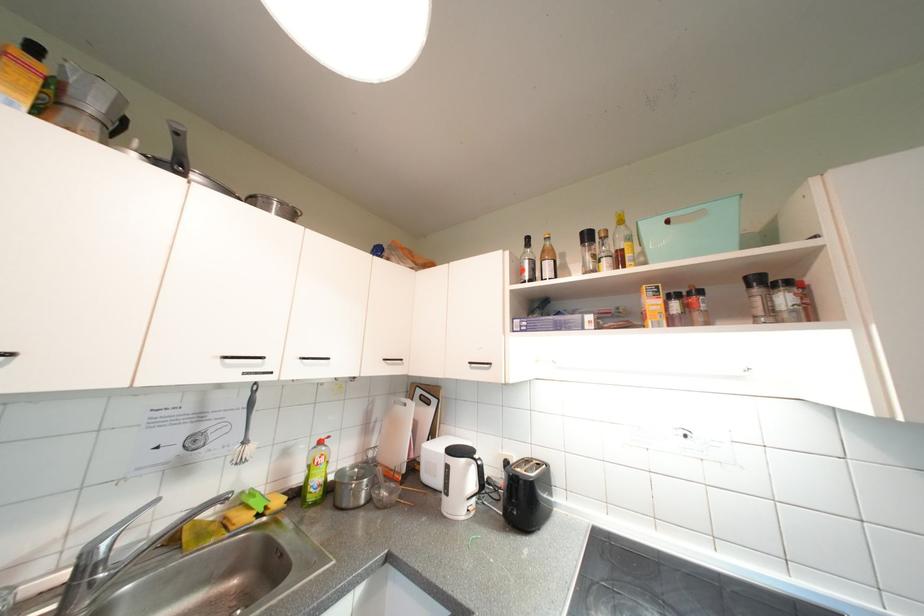
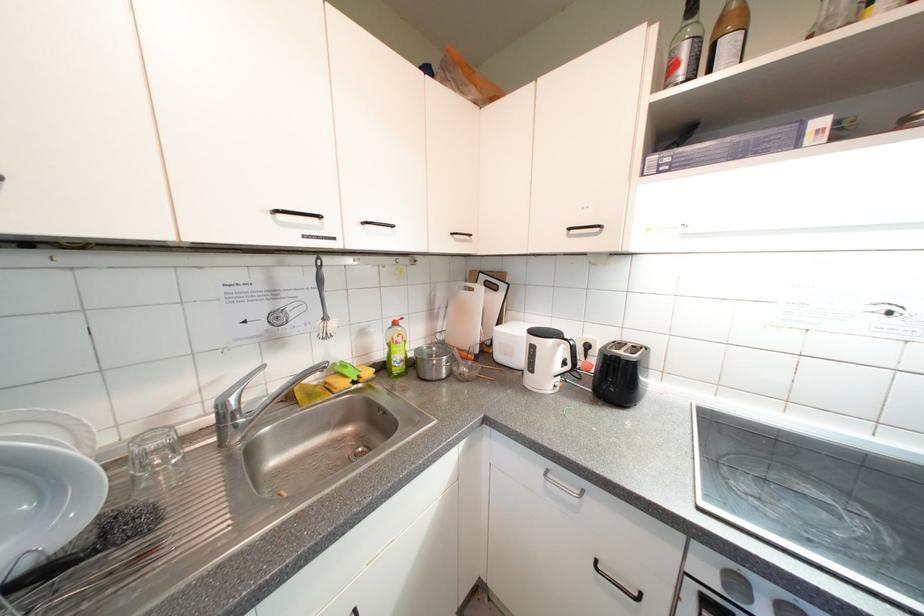
The point at (252, 444) is marked in the first image. Where is the corresponding point in the second image?

(333, 321)